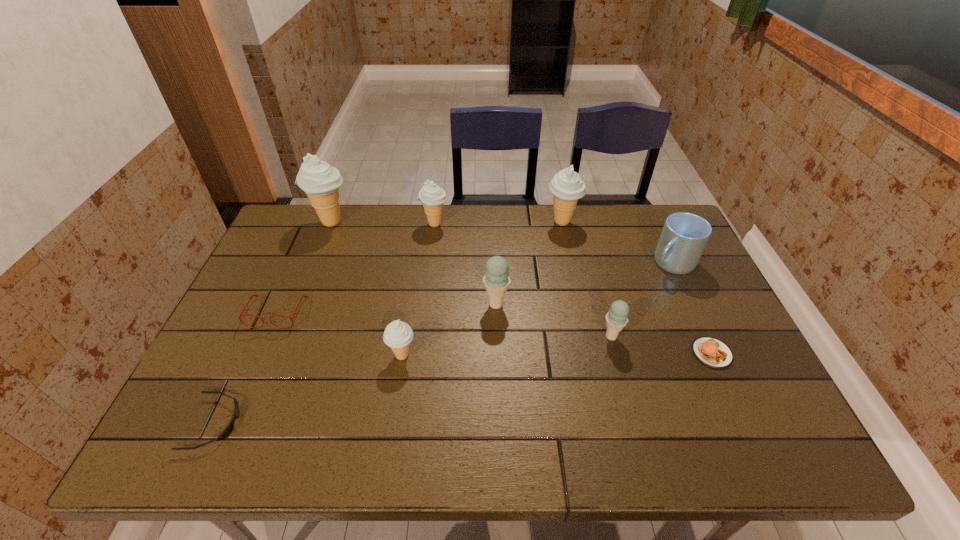
The image size is (960, 540). Find the location of `sunglasses present at the left edge`. sunglasses present at the left edge is located at coordinates (228, 430).

I want to click on mug positioned at the right edge, so click(x=684, y=236).

At what (x,y) coordinates should I click in order to perform the action: click on patty at the right edge. Please return your answer as a coordinate pair (x, y). Looking at the image, I should click on (713, 353).

Image resolution: width=960 pixels, height=540 pixels. In order to click on object that is at the far left corner in this screenshot , I will do `click(320, 181)`.

Find the location of a particular element. The width and height of the screenshot is (960, 540). object present at the near left corner is located at coordinates (228, 430).

Locate an element on the screen. This screenshot has height=540, width=960. object that is positioned at the far right corner is located at coordinates (684, 236).

In the image, there is a desktop. Identify the location of vacant space at the far edge. (336, 246).

Find the location of a particular element. free space at the near edge of the desktop is located at coordinates (656, 427).

Find the location of `vacant area at the left edge of the desktop`. vacant area at the left edge of the desktop is located at coordinates (303, 267).

Where is `free region at the right edge of the desktop`? The width and height of the screenshot is (960, 540). free region at the right edge of the desktop is located at coordinates (702, 268).